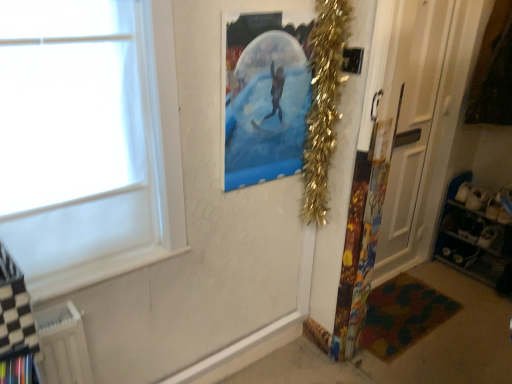
Where is `vacant area located to the right-hand side of multicolored fabric mat at lower right`? This screenshot has width=512, height=384. vacant area located to the right-hand side of multicolored fabric mat at lower right is located at coordinates (466, 309).